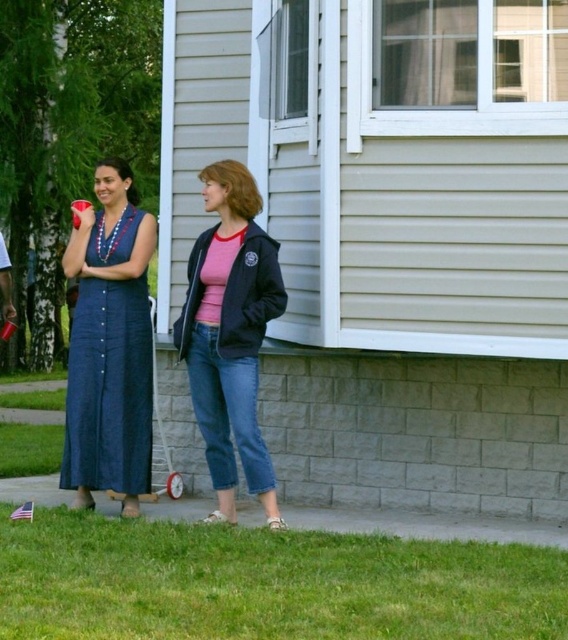
You are planning to set up a small garden in the area shown. Considering the green grass at lower left and the denim dress at left, which one has more space available for planting?

The green grass at lower left has a larger size compared to the denim dress at left, so it has more space available for planting.

You are a gardener who wants to mow the lawn. You see the green grass at lower left and the matte black jacket at center. Which area should you avoid mowing to prevent damaging any objects?

You should avoid mowing the area with the matte black jacket at center because it has a greater height than the green grass at lower left, indicating it might be an object on the ground rather than grass.